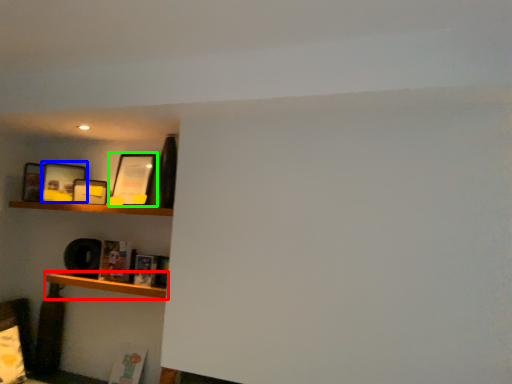
Question: Which is nearer to the shelf (highlighted by a red box)? picture frame (highlighted by a blue box) or picture frame (highlighted by a green box).

Choices:
 (A) picture frame
 (B) picture frame

Answer: (A)